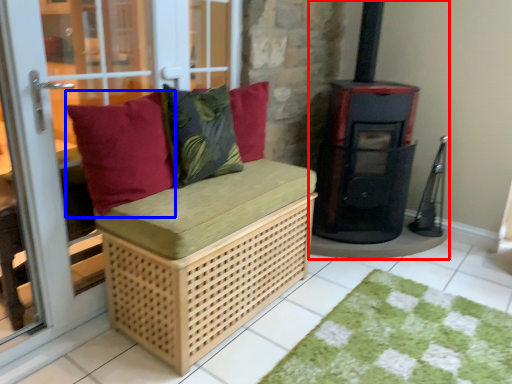
Question: Which point is closer to the camera, wood burning stove (highlighted by a red box) or pillow (highlighted by a blue box)?

Choices:
 (A) wood burning stove
 (B) pillow

Answer: (B)